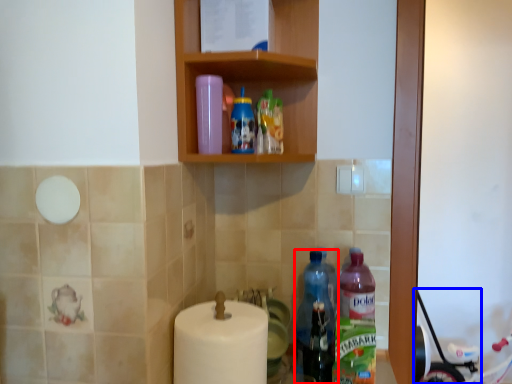
Question: Among these objects, which one is farthest to the camera, bottle (highlighted by a red box) or baby carriage (highlighted by a blue box)?

Choices:
 (A) bottle
 (B) baby carriage

Answer: (B)